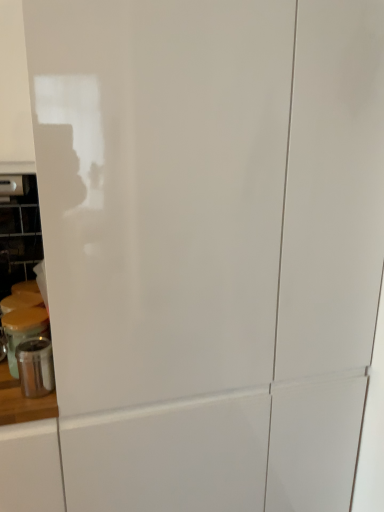
Locate an element on the screen. metallic silver canister at lower left, acting as the second appliance starting from the front is located at coordinates (23, 330).

What do you see at coordinates (23, 330) in the screenshot?
I see `metallic silver canister at lower left, acting as the second appliance starting from the front` at bounding box center [23, 330].

Image resolution: width=384 pixels, height=512 pixels. Describe the element at coordinates (35, 367) in the screenshot. I see `metallic silver canister at left, positioned as the second appliance in back-to-front order` at that location.

Locate an element on the screen. metallic silver canister at left, positioned as the second appliance in back-to-front order is located at coordinates (35, 367).

Identify the location of metallic silver canister at lower left, placed as the first appliance when sorted from back to front. Image resolution: width=384 pixels, height=512 pixels. (23, 330).

Considering the positions of objects metallic silver canister at left, placed as the 1th appliance when sorted from front to back, and metallic silver canister at lower left, placed as the first appliance when sorted from back to front, in the image provided, who is more to the left, metallic silver canister at left, placed as the 1th appliance when sorted from front to back, or metallic silver canister at lower left, placed as the first appliance when sorted from back to front,?

metallic silver canister at lower left, placed as the first appliance when sorted from back to front, is more to the left.

Is the depth of metallic silver canister at left, positioned as the second appliance in back-to-front order, less than that of metallic silver canister at lower left, placed as the first appliance when sorted from back to front?

Yes.

Does point (49, 377) come farther from viewer compared to point (26, 336)?

That is False.

From the image's perspective, is metallic silver canister at left, positioned as the second appliance in back-to-front order, over metallic silver canister at lower left, acting as the second appliance starting from the front?

Actually, metallic silver canister at left, positioned as the second appliance in back-to-front order, appears below metallic silver canister at lower left, acting as the second appliance starting from the front, in the image.

From a real-world perspective, is metallic silver canister at left, placed as the 1th appliance when sorted from front to back, over metallic silver canister at lower left, acting as the second appliance starting from the front?

Incorrect, from a real-world perspective, metallic silver canister at left, placed as the 1th appliance when sorted from front to back, is lower than metallic silver canister at lower left, acting as the second appliance starting from the front.

Which object is thinner, metallic silver canister at left, positioned as the second appliance in back-to-front order, or metallic silver canister at lower left, placed as the first appliance when sorted from back to front?

Thinner between the two is metallic silver canister at left, positioned as the second appliance in back-to-front order.

Looking at this image, considering the relative sizes of metallic silver canister at left, placed as the 1th appliance when sorted from front to back, and metallic silver canister at lower left, acting as the second appliance starting from the front, in the image provided, is metallic silver canister at left, placed as the 1th appliance when sorted from front to back, shorter than metallic silver canister at lower left, acting as the second appliance starting from the front,?

Yes, metallic silver canister at left, placed as the 1th appliance when sorted from front to back, is shorter than metallic silver canister at lower left, acting as the second appliance starting from the front.

Which of these two, metallic silver canister at left, positioned as the second appliance in back-to-front order, or metallic silver canister at lower left, placed as the first appliance when sorted from back to front, is smaller?

metallic silver canister at left, positioned as the second appliance in back-to-front order, is smaller.

Can we say metallic silver canister at left, positioned as the second appliance in back-to-front order, lies outside metallic silver canister at lower left, placed as the first appliance when sorted from back to front?

Yes, metallic silver canister at left, positioned as the second appliance in back-to-front order, is outside of metallic silver canister at lower left, placed as the first appliance when sorted from back to front.

Are metallic silver canister at left, positioned as the second appliance in back-to-front order, and metallic silver canister at lower left, acting as the second appliance starting from the front, making contact?

Yes, metallic silver canister at left, positioned as the second appliance in back-to-front order, is right next to metallic silver canister at lower left, acting as the second appliance starting from the front, and making contact.

Is metallic silver canister at left, placed as the 1th appliance when sorted from front to back, looking in the opposite direction of metallic silver canister at lower left, acting as the second appliance starting from the front?

Yes, metallic silver canister at left, placed as the 1th appliance when sorted from front to back,'s orientation is away from metallic silver canister at lower left, acting as the second appliance starting from the front.

This screenshot has height=512, width=384. In order to click on appliance to the left of metallic silver canister at left, positioned as the second appliance in back-to-front order in this screenshot , I will do `click(23, 330)`.

Considering the positions of objects metallic silver canister at lower left, acting as the second appliance starting from the front, and metallic silver canister at left, positioned as the second appliance in back-to-front order, in the image provided, who is more to the left, metallic silver canister at lower left, acting as the second appliance starting from the front, or metallic silver canister at left, positioned as the second appliance in back-to-front order,?

From the viewer's perspective, metallic silver canister at lower left, acting as the second appliance starting from the front, appears more on the left side.

Between metallic silver canister at lower left, placed as the first appliance when sorted from back to front, and metallic silver canister at left, positioned as the second appliance in back-to-front order, which one is positioned in front?

Positioned in front is metallic silver canister at left, positioned as the second appliance in back-to-front order.

Considering the points (20, 308) and (22, 386), which point is behind, point (20, 308) or point (22, 386)?

Point (20, 308)

From the image's perspective, which one is positioned higher, metallic silver canister at lower left, placed as the first appliance when sorted from back to front, or metallic silver canister at left, positioned as the second appliance in back-to-front order?

metallic silver canister at lower left, placed as the first appliance when sorted from back to front, appears higher in the image.

Based on the photo, from a real-world perspective, is metallic silver canister at lower left, acting as the second appliance starting from the front, located higher than metallic silver canister at left, positioned as the second appliance in back-to-front order?

Yes, from a real-world perspective, metallic silver canister at lower left, acting as the second appliance starting from the front, is above metallic silver canister at left, positioned as the second appliance in back-to-front order.

Considering the relative sizes of metallic silver canister at lower left, placed as the first appliance when sorted from back to front, and metallic silver canister at left, positioned as the second appliance in back-to-front order, in the image provided, is metallic silver canister at lower left, placed as the first appliance when sorted from back to front, wider than metallic silver canister at left, positioned as the second appliance in back-to-front order,?

Indeed, metallic silver canister at lower left, placed as the first appliance when sorted from back to front, has a greater width compared to metallic silver canister at left, positioned as the second appliance in back-to-front order.

Does metallic silver canister at lower left, acting as the second appliance starting from the front, have a lesser height compared to metallic silver canister at left, placed as the 1th appliance when sorted from front to back?

In fact, metallic silver canister at lower left, acting as the second appliance starting from the front, may be taller than metallic silver canister at left, placed as the 1th appliance when sorted from front to back.

Considering the sizes of objects metallic silver canister at lower left, acting as the second appliance starting from the front, and metallic silver canister at left, placed as the 1th appliance when sorted from front to back, in the image provided, who is smaller, metallic silver canister at lower left, acting as the second appliance starting from the front, or metallic silver canister at left, placed as the 1th appliance when sorted from front to back,?

With smaller size is metallic silver canister at left, placed as the 1th appliance when sorted from front to back.

Is metallic silver canister at lower left, acting as the second appliance starting from the front, completely or partially outside of metallic silver canister at left, placed as the 1th appliance when sorted from front to back?

Absolutely, metallic silver canister at lower left, acting as the second appliance starting from the front, is external to metallic silver canister at left, placed as the 1th appliance when sorted from front to back.

From the picture: Is metallic silver canister at lower left, placed as the first appliance when sorted from back to front, positioned far away from metallic silver canister at left, placed as the 1th appliance when sorted from front to back?

No.

Could you tell me if metallic silver canister at lower left, placed as the first appliance when sorted from back to front, is facing metallic silver canister at left, placed as the 1th appliance when sorted from front to back?

Yes, metallic silver canister at lower left, placed as the first appliance when sorted from back to front, is turned towards metallic silver canister at left, placed as the 1th appliance when sorted from front to back.

Can you tell me how much metallic silver canister at lower left, acting as the second appliance starting from the front, and metallic silver canister at left, placed as the 1th appliance when sorted from front to back, differ in facing direction?

They differ by 2.5 degrees in their facing directions.

Identify the location of appliance on the left of metallic silver canister at left, placed as the 1th appliance when sorted from front to back. The width and height of the screenshot is (384, 512). (23, 330).

In order to click on appliance below the metallic silver canister at lower left, placed as the first appliance when sorted from back to front (from the image's perspective) in this screenshot , I will do `click(35, 367)`.

You are a GUI agent. You are given a task and a screenshot of the screen. Output one action in this format:
    pyautogui.click(x=<x>, y=<y>)
    Task: Click on the appliance lying above the metallic silver canister at left, positioned as the second appliance in back-to-front order (from the image's perspective)
    This screenshot has height=512, width=384.
    Given the screenshot: What is the action you would take?
    pyautogui.click(x=23, y=330)